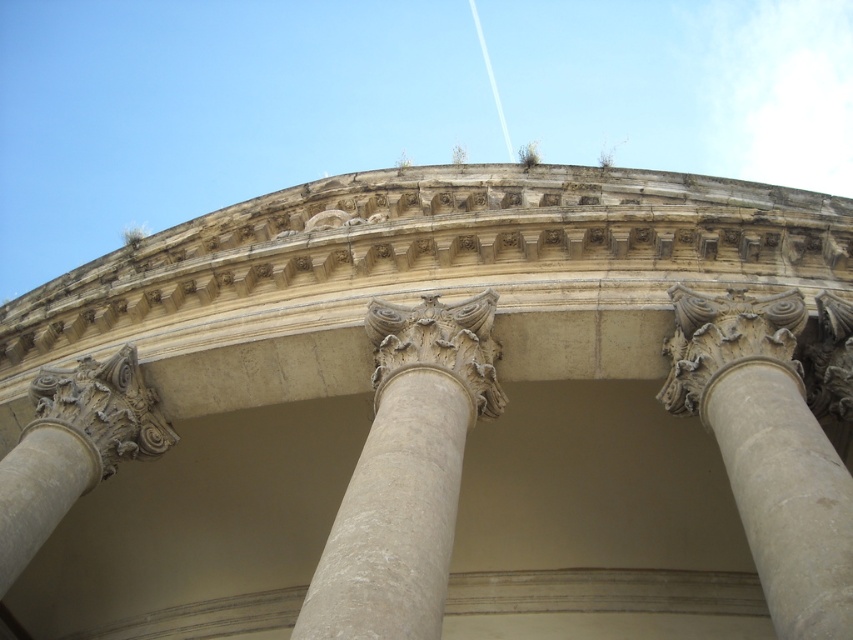
Question: Which of the following is the closest to the observer?

Choices:
 (A) white stone column at right
 (B) white stone column at center

Answer: (A)

Question: Where is white stone column at center located in relation to white stone column at right in the image?

Choices:
 (A) right
 (B) left

Answer: (B)

Question: Observing the image, what is the correct spatial positioning of white stone column at center in reference to white stone column at right?

Choices:
 (A) below
 (B) above

Answer: (A)

Question: Among these objects, which one is farthest from the camera?

Choices:
 (A) white stone column at center
 (B) white stone column at right

Answer: (A)

Question: Is white stone column at center in front of white stone column at right?

Choices:
 (A) no
 (B) yes

Answer: (A)